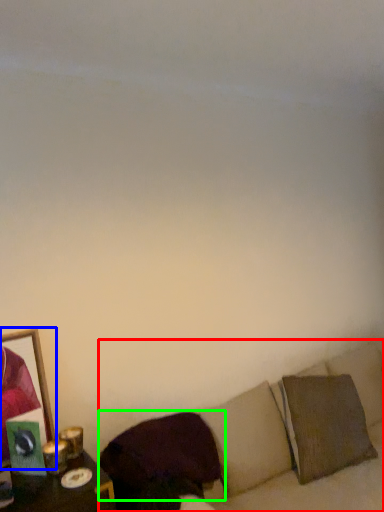
Question: Which object is positioned farthest from couch (highlighted by a red box)? Select from picture frame (highlighted by a blue box) and pillow (highlighted by a green box).

Choices:
 (A) picture frame
 (B) pillow

Answer: (A)